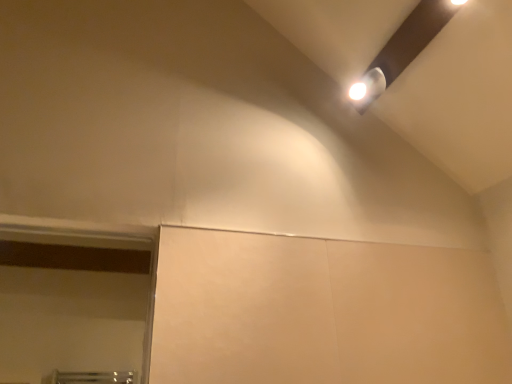
Locate an element on the screen. The height and width of the screenshot is (384, 512). white glossy light fixture at upper right is located at coordinates (367, 89).

The image size is (512, 384). What do you see at coordinates (367, 89) in the screenshot?
I see `white glossy light fixture at upper right` at bounding box center [367, 89].

At what (x,y) coordinates should I click in order to perform the action: click on white glossy light fixture at upper right. Please return your answer as a coordinate pair (x, y). Image resolution: width=512 pixels, height=384 pixels. Looking at the image, I should click on (367, 89).